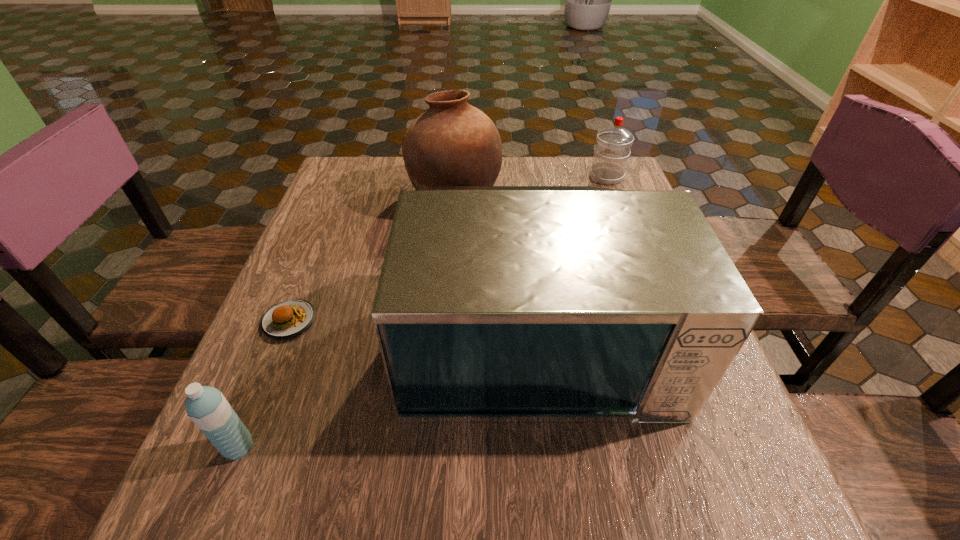
You are a GUI agent. You are given a task and a screenshot of the screen. Output one action in this format:
    pyautogui.click(x=<x>, y=<y>)
    Task: Click on the vacant area at the left edge
    This screenshot has width=960, height=540.
    Given the screenshot: What is the action you would take?
    pyautogui.click(x=289, y=289)

At what (x,y) coordinates should I click in order to perform the action: click on vacant area at the near right corner. Please return your answer as a coordinate pair (x, y). The height and width of the screenshot is (540, 960). Looking at the image, I should click on (719, 522).

Locate an element on the screen. This screenshot has width=960, height=540. vacant space that is in between the left water bottle and the pottery is located at coordinates (347, 322).

The image size is (960, 540). I want to click on vacant region between the food and the pottery, so click(372, 258).

In order to click on free space that is in between the pottery and the food in this screenshot , I will do `click(372, 258)`.

The width and height of the screenshot is (960, 540). What are the coordinates of `free space between the shortest object and the nearest object` in the screenshot? It's located at (264, 384).

Locate an element on the screen. The height and width of the screenshot is (540, 960). vacant region between the nearest object and the pottery is located at coordinates (347, 322).

Locate an element on the screen. vacant area that lies between the nearest object and the microwave oven is located at coordinates (388, 393).

Locate which object ranks in proximity to the shortest object. Please provide its 2D coordinates. Your answer should be formatted as a tuple, i.e. [(x, y)], where the tuple contains the x and y coordinates of a point satisfying the conditions above.

[(208, 409)]

The image size is (960, 540). In order to click on the closest object to the left water bottle in this screenshot , I will do `click(289, 318)`.